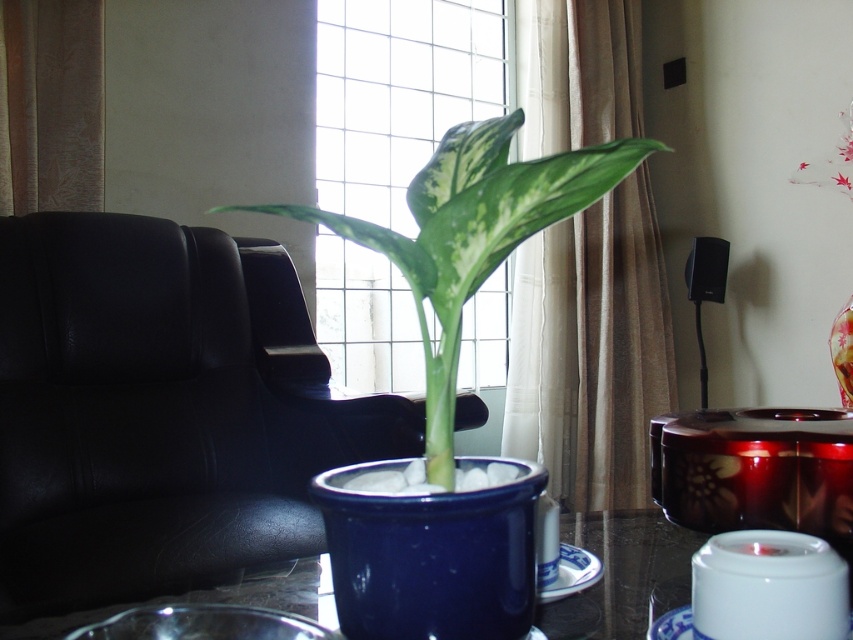
Is green glossy leaf at center bigger than matte red flower at upper right?

Correct, green glossy leaf at center is larger in size than matte red flower at upper right.

The image size is (853, 640). I want to click on green glossy leaf at center, so click(473, 236).

At what (x,y) coordinates should I click in order to perform the action: click on green glossy leaf at center. Please return your answer as a coordinate pair (x, y). The image size is (853, 640). Looking at the image, I should click on (473, 236).

The height and width of the screenshot is (640, 853). Describe the element at coordinates (473, 236) in the screenshot. I see `green glossy leaf at center` at that location.

Which is below, green glossy leaf at center or glossy ceramic table at center?

glossy ceramic table at center

Between point (451, 438) and point (610, 589), which one is positioned behind?

Point (610, 589)

Image resolution: width=853 pixels, height=640 pixels. Identify the location of green glossy leaf at center. (473, 236).

Can you confirm if green glossy leaf at center is positioned below transparent glass vase at upper right?

Incorrect, green glossy leaf at center is not positioned below transparent glass vase at upper right.

Is point (439, 289) farther from camera compared to point (848, 385)?

No, (439, 289) is in front of (848, 385).

The height and width of the screenshot is (640, 853). Describe the element at coordinates (473, 236) in the screenshot. I see `green glossy leaf at center` at that location.

This screenshot has height=640, width=853. I want to click on green glossy leaf at center, so click(x=473, y=236).